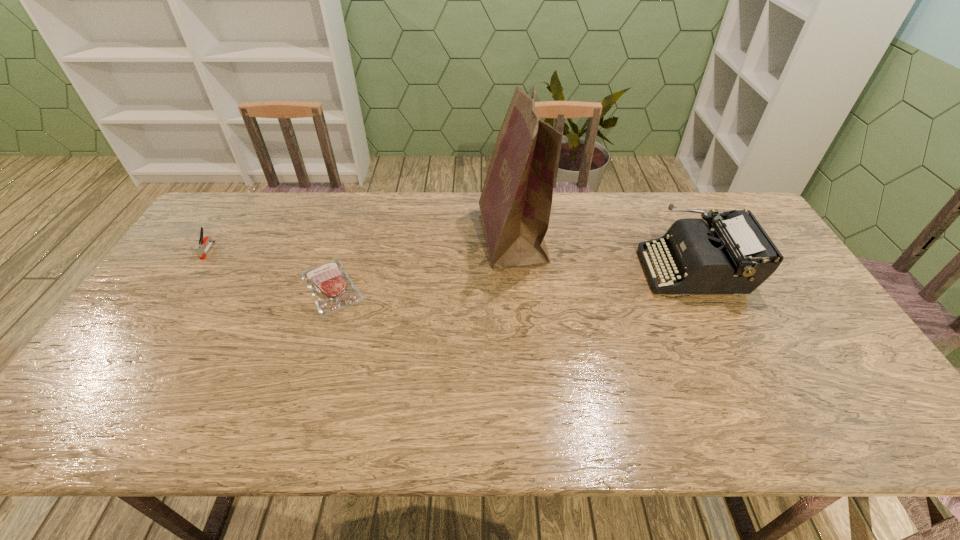
Image resolution: width=960 pixels, height=540 pixels. I want to click on free space located on the front-facing side of the grocery bag, so click(x=358, y=237).

Where is `blank space located 0.230m on the front-facing side of the rightmost object`? blank space located 0.230m on the front-facing side of the rightmost object is located at coordinates (567, 269).

Where is `blank space located 0.210m on the front-facing side of the rightmost object`? This screenshot has width=960, height=540. blank space located 0.210m on the front-facing side of the rightmost object is located at coordinates (573, 269).

Image resolution: width=960 pixels, height=540 pixels. What are the coordinates of `vacant region located on the front-facing side of the rightmost object` in the screenshot? It's located at (x=597, y=269).

The width and height of the screenshot is (960, 540). I want to click on free space located 0.380m on the handle side of the second shortest object, so 133,364.

Image resolution: width=960 pixels, height=540 pixels. I want to click on free spot located 0.170m on the back of the shortest object, so click(352, 224).

At what (x,y) coordinates should I click in order to perform the action: click on object that is at the far edge. Please return your answer as a coordinate pair (x, y). Looking at the image, I should click on (515, 204).

The width and height of the screenshot is (960, 540). I want to click on object at the left edge, so 199,249.

The image size is (960, 540). Find the location of `object at the right edge`. object at the right edge is located at coordinates point(736,257).

In order to click on vacant space at the far edge in this screenshot , I will do `click(325, 195)`.